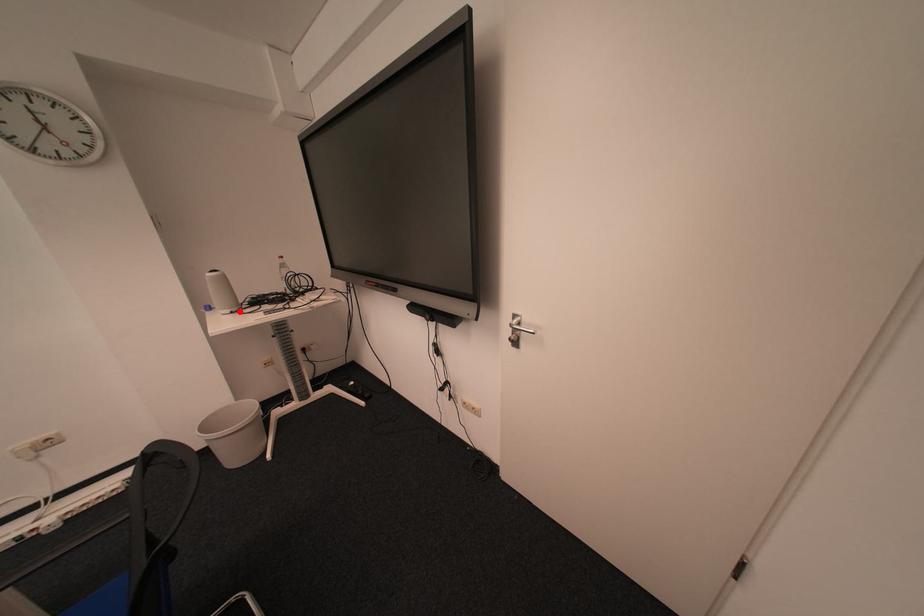
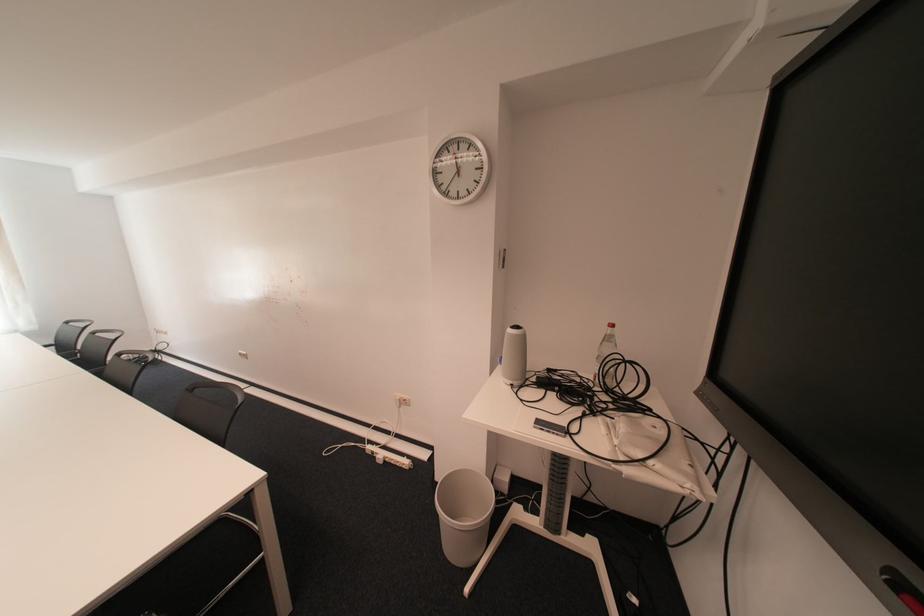
The point at the highlighted location is marked in the first image. Where is the corresponding point in the second image?

(520, 383)